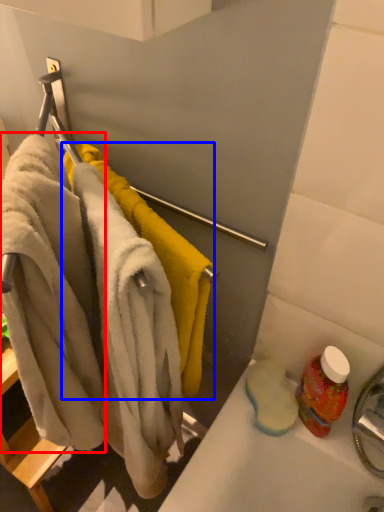
Question: Among these objects, which one is nearest to the camera, bath towel (highlighted by a red box) or towel (highlighted by a blue box)?

Choices:
 (A) bath towel
 (B) towel

Answer: (A)